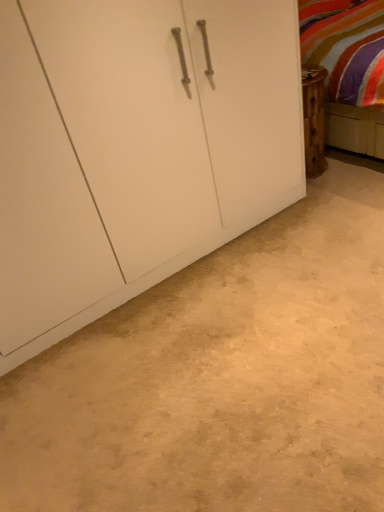
You are a GUI agent. You are given a task and a screenshot of the screen. Output one action in this format:
    pyautogui.click(x=<x>, y=<y>)
    Task: Click on the beige carpet at lower center
    This screenshot has height=512, width=384.
    Given the screenshot: What is the action you would take?
    pyautogui.click(x=222, y=377)

What do you see at coordinates (222, 377) in the screenshot?
I see `beige carpet at lower center` at bounding box center [222, 377].

Measure the distance between beige carpet at lower center and camera.

beige carpet at lower center is 1.16 meters away from camera.

I want to click on beige carpet at lower center, so click(222, 377).